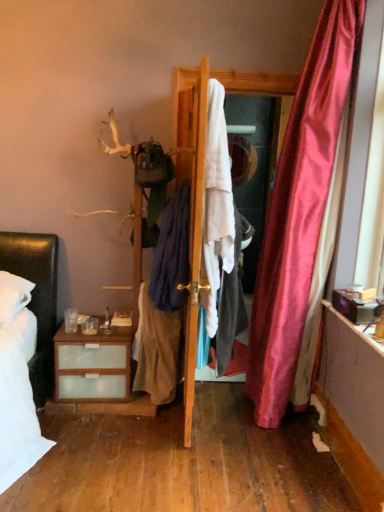
The image size is (384, 512). What do you see at coordinates (203, 175) in the screenshot?
I see `white fabric at center` at bounding box center [203, 175].

Find the location of `matte white mirror at center`. matte white mirror at center is located at coordinates [241, 159].

Between light brown fabric skirt at center, the third clothing viewed from the right, and matte white mirror at center, which one has less height?

Standing shorter between the two is matte white mirror at center.

Is light brown fabric skirt at center, the third clothing viewed from the right, positioned in front of matte white mirror at center?

Yes, it is.

Is light brown fabric skirt at center, which ranks as the first clothing in left-to-right order, looking in the opposite direction of matte white mirror at center?

That's not correct — light brown fabric skirt at center, which ranks as the first clothing in left-to-right order, is not looking away from matte white mirror at center.

From the image's perspective, which is below, light brown fabric skirt at center, which ranks as the first clothing in left-to-right order, or matte white mirror at center?

light brown fabric skirt at center, which ranks as the first clothing in left-to-right order.

Would you consider white fabric at center to be distant from white cotton shirt at center, marked as the first clothing in a right-to-left arrangement?

white fabric at center is near white cotton shirt at center, marked as the first clothing in a right-to-left arrangement, not far away.

Which is in front, white fabric at center or white cotton shirt at center, placed as the third clothing when sorted from left to right?

Positioned in front is white cotton shirt at center, placed as the third clothing when sorted from left to right.

What's the angular difference between white fabric at center and white cotton shirt at center, marked as the first clothing in a right-to-left arrangement,'s facing directions?

0.611 degrees.

I want to click on screen door to the right of white cotton shirt at center, placed as the third clothing when sorted from left to right, so click(203, 175).

From a real-world perspective, who is located higher, wooden door at center or light brown fabric skirt at center, which ranks as the first clothing in left-to-right order?

In real-world perspective, wooden door at center is above.

Considering the positions of point (194, 82) and point (176, 333), is point (194, 82) closer or farther from the camera than point (176, 333)?

Point (194, 82) is positioned closer to the camera compared to point (176, 333).

Can you confirm if wooden door at center is positioned to the right of light brown fabric skirt at center, the third clothing viewed from the right?

Indeed, wooden door at center is positioned on the right side of light brown fabric skirt at center, the third clothing viewed from the right.

Does wooden door at center have a lesser height compared to light brown fabric skirt at center, which ranks as the first clothing in left-to-right order?

No.

From their relative heights in the image, would you say dark blue fabric at center, the second clothing positioned from the right, is taller or shorter than white fabric at center?

Considering their sizes, dark blue fabric at center, the second clothing positioned from the right, has less height than white fabric at center.

Looking at this image, from a real-world perspective, which is physically below, dark blue fabric at center, the second clothing from the left, or white fabric at center?

dark blue fabric at center, the second clothing from the left, from a real-world perspective.

What's the angular difference between dark blue fabric at center, the second clothing from the left, and white fabric at center's facing directions?

0.00274 degrees.

Is dark blue fabric at center, the second clothing positioned from the right, positioned in front of white fabric at center?

Yes, dark blue fabric at center, the second clothing positioned from the right, is closer to the camera.

From a real-world perspective, is matte white mirror at center above or below white cotton shirt at center, placed as the third clothing when sorted from left to right?

matte white mirror at center is situated higher than white cotton shirt at center, placed as the third clothing when sorted from left to right, in the real world.

Is matte white mirror at center looking in the opposite direction of white cotton shirt at center, placed as the third clothing when sorted from left to right?

No, white cotton shirt at center, placed as the third clothing when sorted from left to right, is not at the back of matte white mirror at center.

From the image's perspective, which is below, matte white mirror at center or white cotton shirt at center, placed as the third clothing when sorted from left to right?

white cotton shirt at center, placed as the third clothing when sorted from left to right, from the image's perspective.

Considering the sizes of objects white cotton shirt at center, placed as the third clothing when sorted from left to right, and white fabric at center in the image provided, who is smaller, white cotton shirt at center, placed as the third clothing when sorted from left to right, or white fabric at center?

Smaller between the two is white fabric at center.

From a real-world perspective, between white cotton shirt at center, placed as the third clothing when sorted from left to right, and white fabric at center, who is vertically lower?

From a 3D spatial view, white cotton shirt at center, placed as the third clothing when sorted from left to right, is below.

From their relative heights in the image, would you say white cotton shirt at center, placed as the third clothing when sorted from left to right, is taller or shorter than white fabric at center?

Considering their sizes, white cotton shirt at center, placed as the third clothing when sorted from left to right, has less height than white fabric at center.

Is white cotton shirt at center, marked as the first clothing in a right-to-left arrangement, wider or thinner than white fabric at center?

In the image, white cotton shirt at center, marked as the first clothing in a right-to-left arrangement, appears to be wider than white fabric at center.

What's the angular difference between light brown fabric skirt at center, which ranks as the first clothing in left-to-right order, and wooden door at center's facing directions?

0.000391 degrees separate the facing orientations of light brown fabric skirt at center, which ranks as the first clothing in left-to-right order, and wooden door at center.

Is light brown fabric skirt at center, the third clothing viewed from the right, taller than wooden door at center?

Incorrect, the height of light brown fabric skirt at center, the third clothing viewed from the right, is not larger of that of wooden door at center.

Is light brown fabric skirt at center, which ranks as the first clothing in left-to-right order, next to wooden door at center and touching it?

No, light brown fabric skirt at center, which ranks as the first clothing in left-to-right order, is not making contact with wooden door at center.

Locate an element on the screen. This screenshot has height=512, width=384. mirror that appears on the right of light brown fabric skirt at center, which ranks as the first clothing in left-to-right order is located at coordinates pyautogui.click(x=241, y=159).

Find the location of a particular element. The height and width of the screenshot is (512, 384). the 2nd clothing positioned below the white fabric at center (from the image's perspective) is located at coordinates (231, 298).

When comparing their distances from light brown fabric skirt at center, which ranks as the first clothing in left-to-right order, does wooden door at center or dark blue fabric at center, the second clothing positioned from the right, seem further?

wooden door at center.

When comparing their distances from dark blue fabric at center, the second clothing from the left, does light brown fabric skirt at center, which ranks as the first clothing in left-to-right order, or matte white mirror at center seem further?

Based on the image, matte white mirror at center appears to be further to dark blue fabric at center, the second clothing from the left.

Looking at the image, which one is located further to white cotton shirt at center, marked as the first clothing in a right-to-left arrangement, dark blue fabric at center, the second clothing positioned from the right, or wooden door at center?

wooden door at center.

From the image, which object appears to be farther from light brown fabric skirt at center, which ranks as the first clothing in left-to-right order, white fabric at center or matte white mirror at center?

Among the two, matte white mirror at center is located further to light brown fabric skirt at center, which ranks as the first clothing in left-to-right order.

Based on their spatial positions, is white fabric at center or wooden door at center further from light brown fabric skirt at center, the third clothing viewed from the right?

The object further to light brown fabric skirt at center, the third clothing viewed from the right, is white fabric at center.

Which object lies nearer to the anchor point white fabric at center, dark blue fabric at center, the second clothing positioned from the right, or light brown fabric skirt at center, which ranks as the first clothing in left-to-right order?

Among the two, dark blue fabric at center, the second clothing positioned from the right, is located nearer to white fabric at center.

When comparing their distances from light brown fabric skirt at center, the third clothing viewed from the right, does matte white mirror at center or white fabric at center seem closer?

The object closer to light brown fabric skirt at center, the third clothing viewed from the right, is white fabric at center.

Looking at the image, which one is located closer to dark blue fabric at center, the second clothing positioned from the right, wooden door at center or light brown fabric skirt at center, which ranks as the first clothing in left-to-right order?

light brown fabric skirt at center, which ranks as the first clothing in left-to-right order, is closer to dark blue fabric at center, the second clothing positioned from the right.

Find the location of a particular element. This screenshot has height=512, width=384. door between dark blue fabric at center, the second clothing from the left, and light brown fabric skirt at center, which ranks as the first clothing in left-to-right order, in the up-down direction is located at coordinates (191, 201).

Identify the location of clothing located between wooden door at center and dark blue fabric at center, the second clothing from the left, in the depth direction. (231, 298).

Locate an element on the screen. Image resolution: width=384 pixels, height=512 pixels. clothing between dark blue fabric at center, the second clothing from the left, and matte white mirror at center, along the z-axis is located at coordinates (156, 350).

Locate an element on the screen. screen door positioned between white cotton shirt at center, placed as the third clothing when sorted from left to right, and matte white mirror at center from near to far is located at coordinates (203, 175).